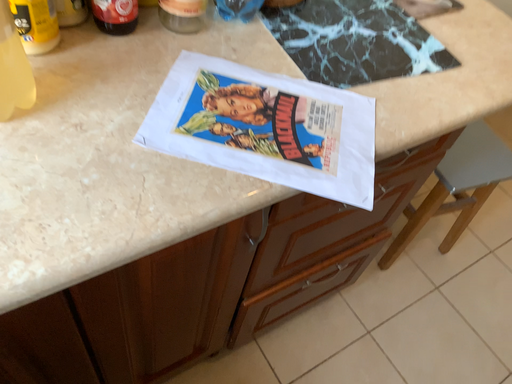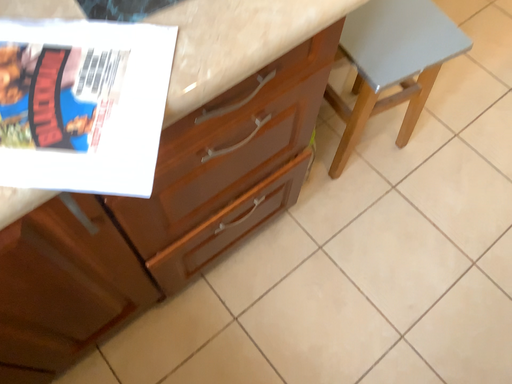
Question: How did the camera likely rotate when shooting the video?

Choices:
 (A) rotated upward
 (B) rotated downward

Answer: (B)